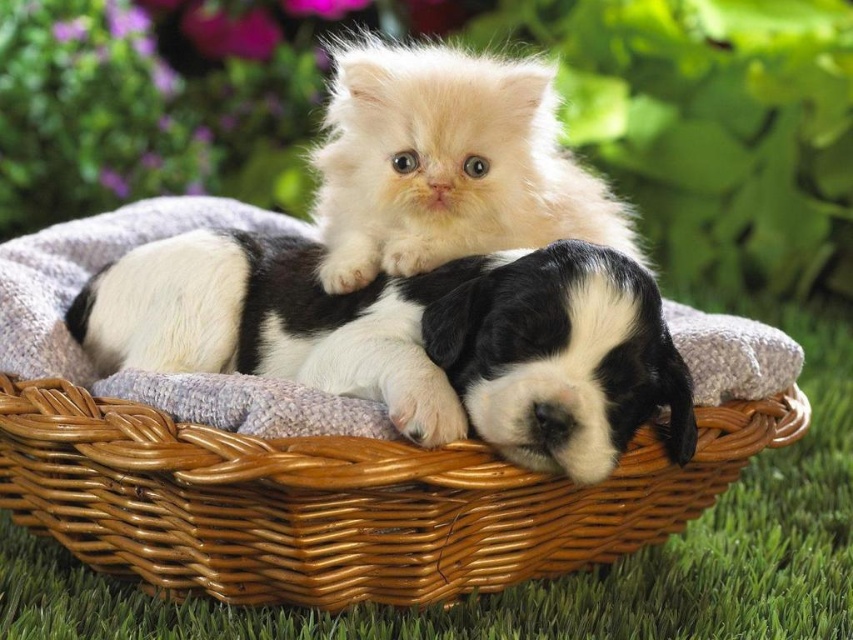
Question: Is woven brown basket at center positioned in front of fluffy white cat at upper center?

Choices:
 (A) yes
 (B) no

Answer: (A)

Question: Based on their relative distances, which object is farther from the black and white fur at center?

Choices:
 (A) woven brown basket at center
 (B) fluffy white cat at upper center

Answer: (B)

Question: Can you confirm if woven brown basket at center is wider than black and white fur at center?

Choices:
 (A) no
 (B) yes

Answer: (B)

Question: Among these objects, which one is farthest from the camera?

Choices:
 (A) black and white fur at center
 (B) fluffy white cat at upper center

Answer: (B)

Question: Which object is closer to the camera taking this photo?

Choices:
 (A) fluffy white cat at upper center
 (B) black and white fur at center
 (C) woven brown basket at center

Answer: (C)

Question: Is woven brown basket at center to the right of fluffy white cat at upper center from the viewer's perspective?

Choices:
 (A) yes
 (B) no

Answer: (B)